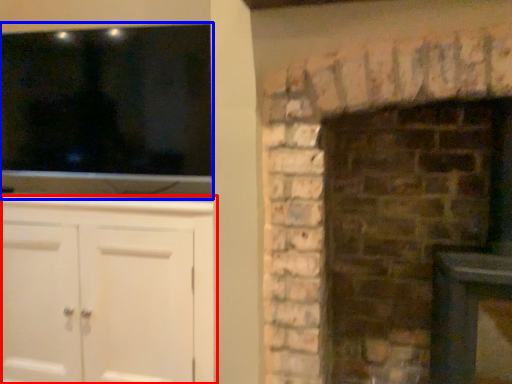
Question: Which object appears farthest to the camera in this image, cabinetry (highlighted by a red box) or window (highlighted by a blue box)?

Choices:
 (A) cabinetry
 (B) window

Answer: (B)